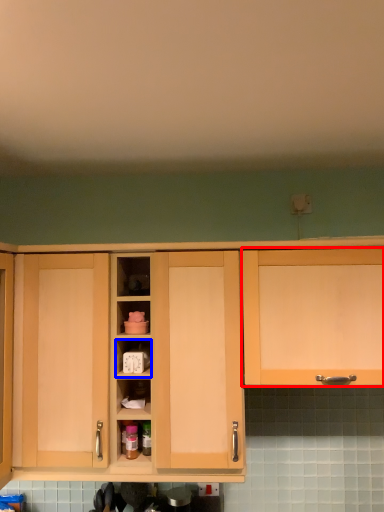
Question: Which object appears farthest to the camera in this image, cabinetry (highlighted by a red box) or cabinet (highlighted by a blue box)?

Choices:
 (A) cabinetry
 (B) cabinet

Answer: (B)